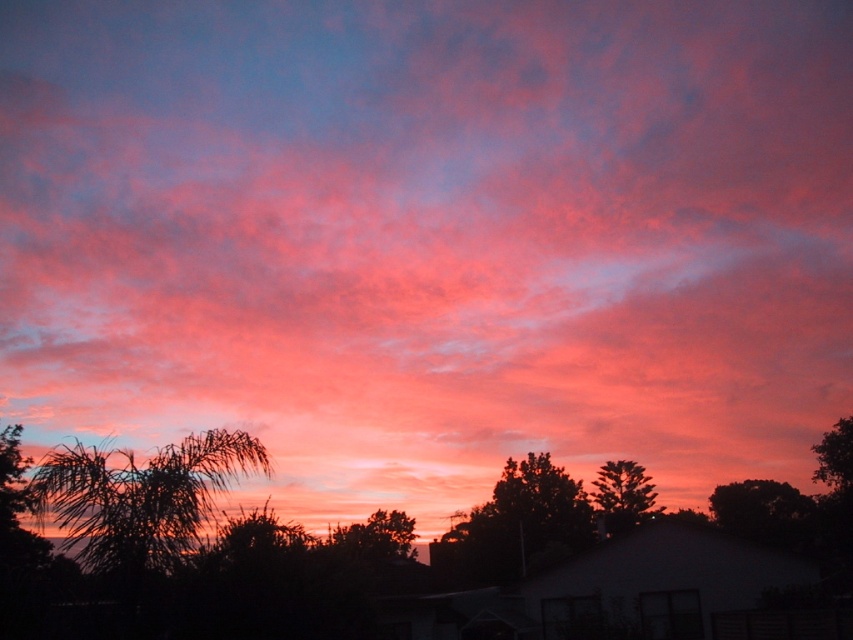
Question: Which is nearer to the dark green leafy tree at lower right?

Choices:
 (A) green leafy tree at right
 (B) silhouette leafy tree at upper right
 (C) silky brown tree at center
 (D) silhouette leafy tree at center

Answer: (B)

Question: Which point is closer to the camera?

Choices:
 (A) (602, 513)
 (B) (405, 538)

Answer: (A)

Question: Does dark green leafy tree at lower right lie in front of green leafy tree at right?

Choices:
 (A) yes
 (B) no

Answer: (A)

Question: Which of the following is the farthest from the observer?

Choices:
 (A) green leafy tree at right
 (B) silhouette palm tree at lower left

Answer: (A)

Question: Considering the relative positions of silhouette leafy tree at center and silky brown tree at center in the image provided, where is silhouette leafy tree at center located with respect to silky brown tree at center?

Choices:
 (A) above
 (B) below

Answer: (A)

Question: Is silhouette palm tree at lower left in front of dark green leafy tree at lower right?

Choices:
 (A) no
 (B) yes

Answer: (B)